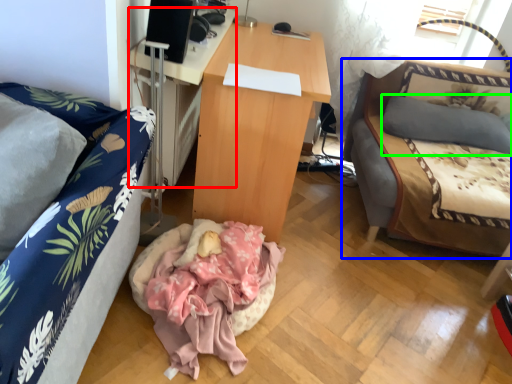
Question: Which is nearer to the desk (highlighted by a red box)? studio couch (highlighted by a blue box) or pillow (highlighted by a green box).

Choices:
 (A) studio couch
 (B) pillow

Answer: (A)